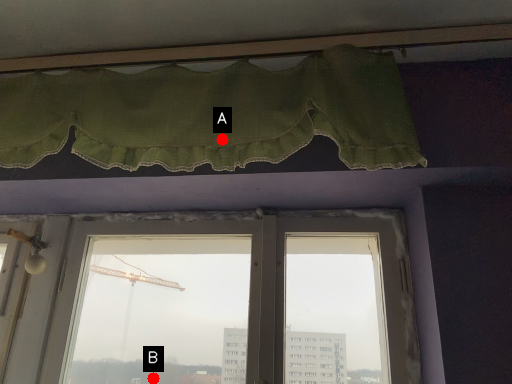
Question: Two points are circled on the image, labeled by A and B beside each circle. Which point is closer to the camera?

Choices:
 (A) A is closer
 (B) B is closer

Answer: (A)